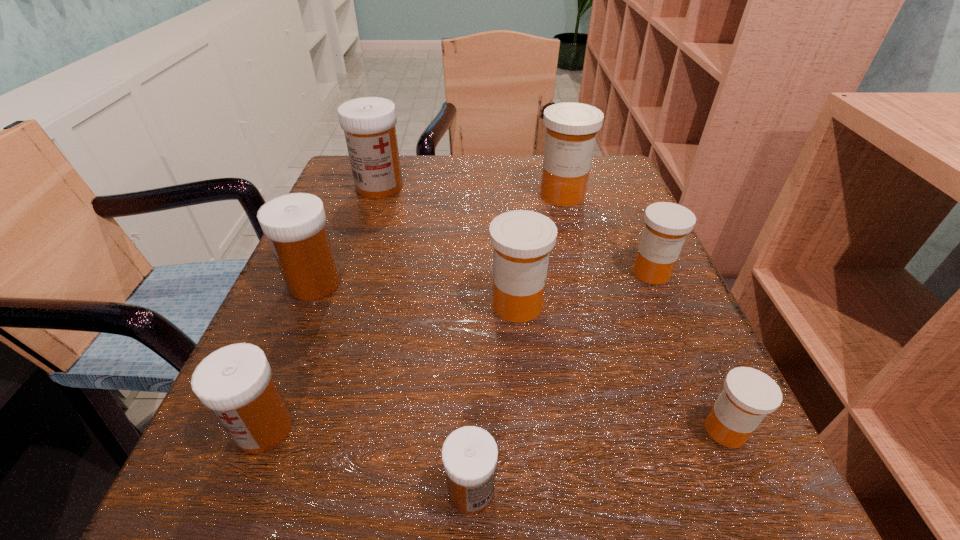
Where is `vacant region located on the right of the biggest white medicine`? This screenshot has height=540, width=960. vacant region located on the right of the biggest white medicine is located at coordinates (570, 187).

Where is `vacant position located on the label of the farthest orange medicine`? vacant position located on the label of the farthest orange medicine is located at coordinates (592, 310).

The height and width of the screenshot is (540, 960). I want to click on vacant space located on the label of the leftmost orange medicine, so click(x=396, y=305).

Identify the location of free space located on the label of the leftmost orange medicine. This screenshot has height=540, width=960. (401, 305).

Identify the location of vacant position located 0.050m on the label of the leftmost orange medicine. The height and width of the screenshot is (540, 960). (457, 305).

Where is `free space located on the back of the third nearest white medicine`? free space located on the back of the third nearest white medicine is located at coordinates (338, 226).

I want to click on vacant space situated 0.270m on the label of the second smallest orange medicine, so click(x=724, y=437).

You are a GUI agent. You are given a task and a screenshot of the screen. Output one action in this format:
    pyautogui.click(x=<x>, y=<y>)
    Task: Click on the free space located 0.340m on the back of the third farthest white medicine
    
    Given the screenshot: What is the action you would take?
    pyautogui.click(x=337, y=244)

Locate an element on the screen. This screenshot has height=540, width=960. free space located 0.340m on the label of the smallest orange medicine is located at coordinates (430, 430).

At what (x,y) coordinates should I click in order to perform the action: click on free space located on the label of the smallest orange medicine. Please return your answer as a coordinate pair (x, y). Looking at the image, I should click on (607, 430).